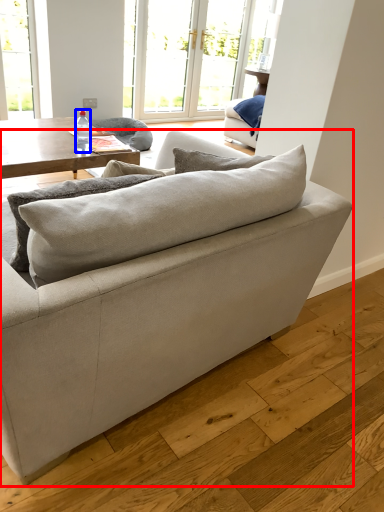
Question: Which object is closer to the camera taking this photo, studio couch (highlighted by a red box) or bottle (highlighted by a blue box)?

Choices:
 (A) studio couch
 (B) bottle

Answer: (A)